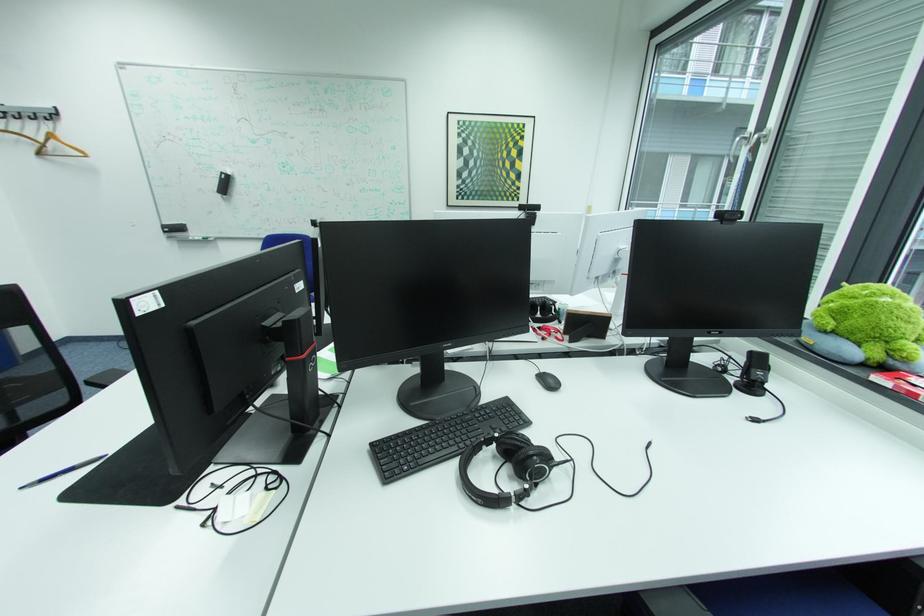
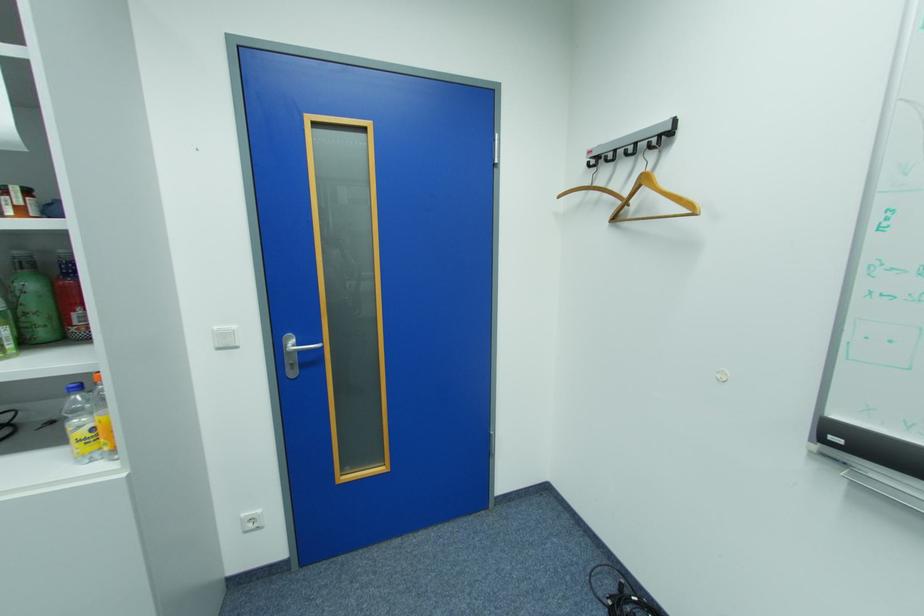
Locate, in the second image, the point that corresponds to (x=49, y=153) in the first image.

(624, 220)